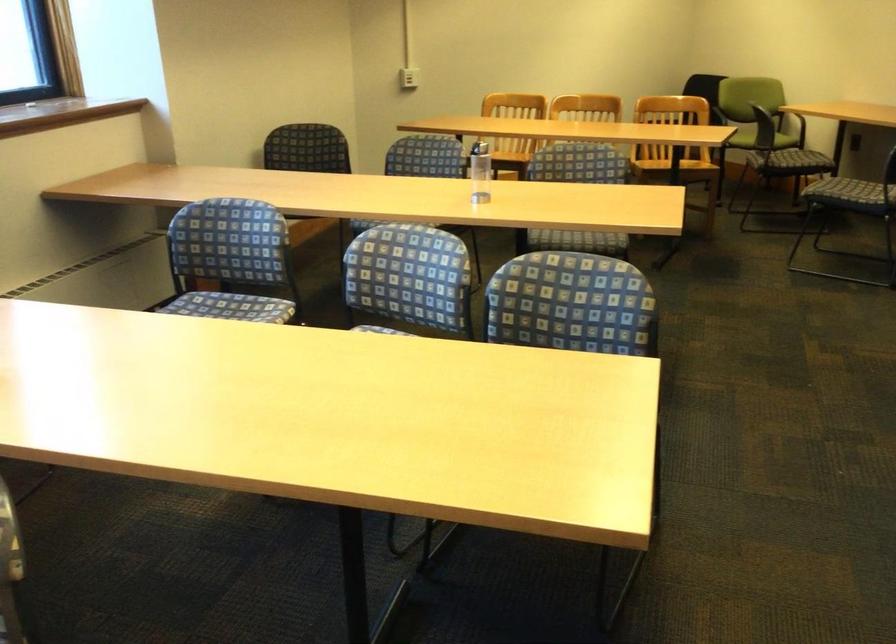
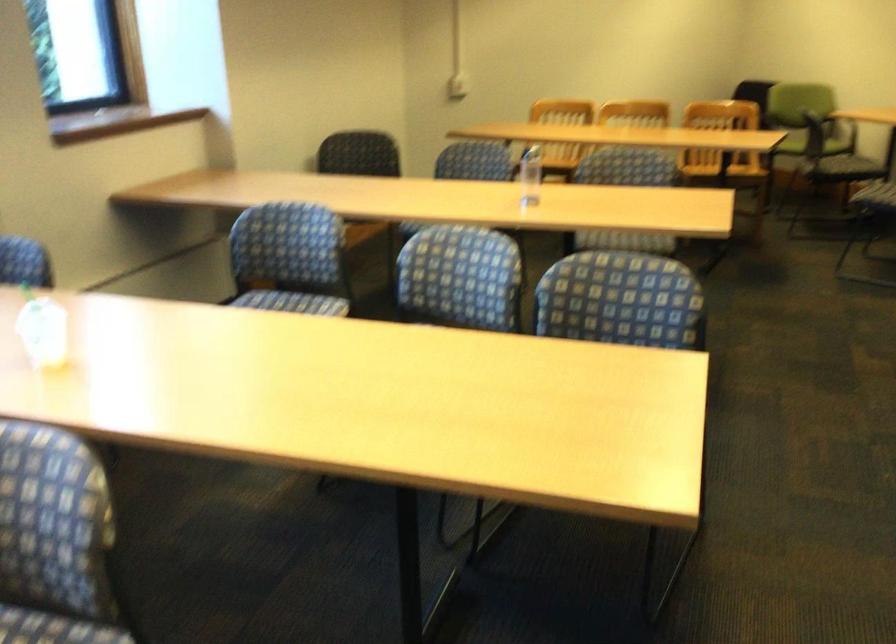
Where in the second image is the point corresponding to pixel 574 301 from the first image?

(622, 301)